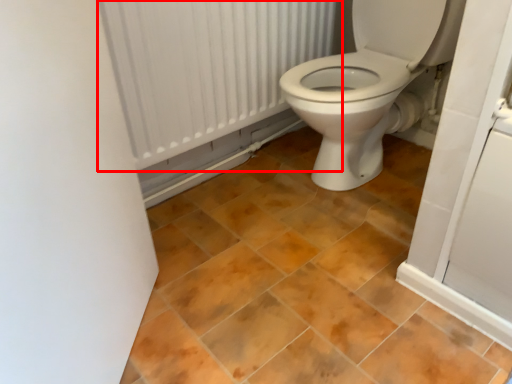
Question: From the image's perspective, where is radiator (annotated by the red box) located relative to ceramic tile?

Choices:
 (A) below
 (B) above

Answer: (B)